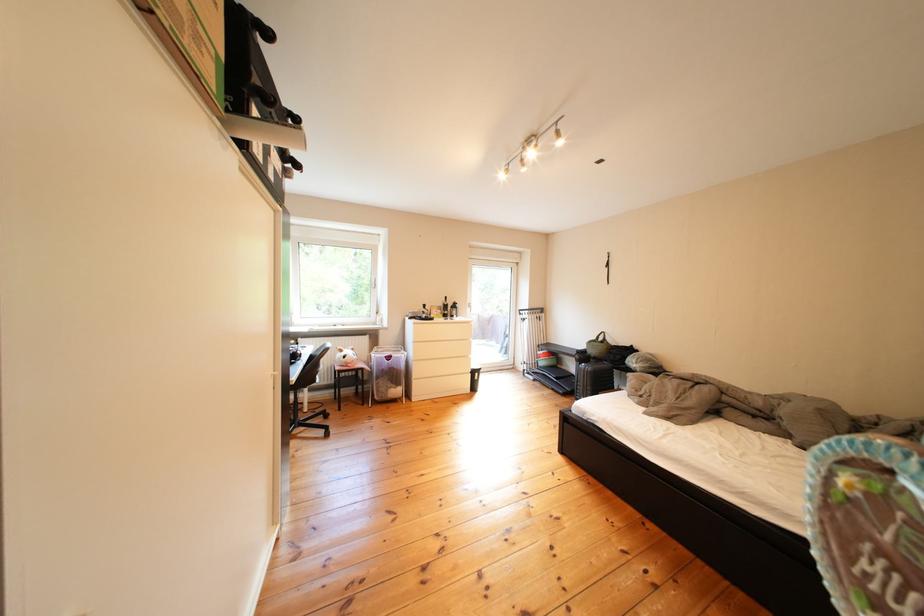
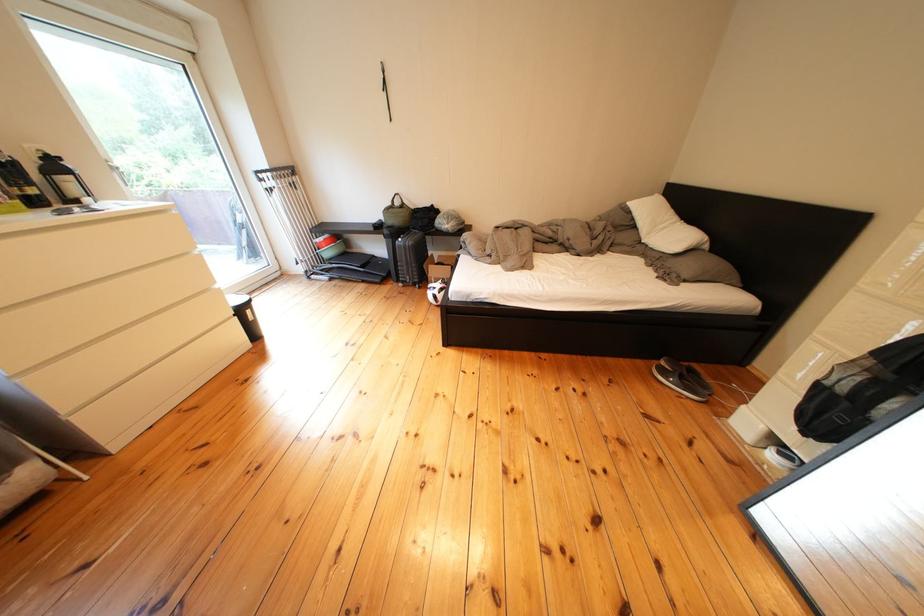
Find the pixel in the second image that matches the point at 591,361 in the first image.

(399, 236)